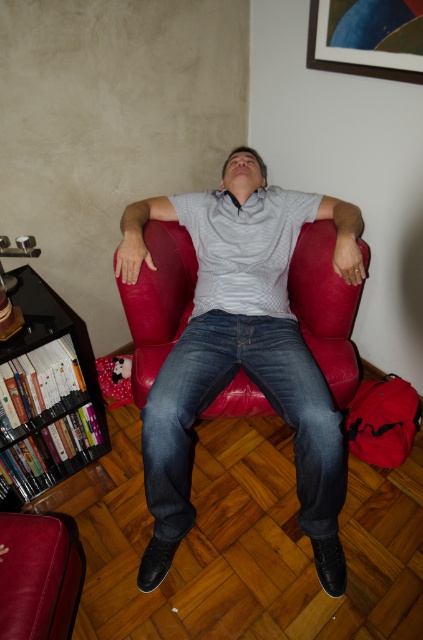
You are standing in the living room and want to place a 2.5 meter long banner from the camera position to the point marked as point (310, 204). Will the banner be long enough to reach that point?

The point marked as point (310, 204) is 1.81 meters from the camera, so the 2.5 meter banner will be long enough to reach that point.

You are standing in the living room and see the gray textured shirt at center and the metallic gold picture frame at upper right. Which object is positioned to the left of the other?

The gray textured shirt at center is to the left of the metallic gold picture frame at upper right.

You are standing in the living room and want to place a small decorative item between the two points marked as point (x=260, y=385) and point (x=3, y=426). Since you want the item to be closer to the viewer, which point should you position it near?

You should position the item near point (x=260, y=385) because it is closer to the viewer than point (x=3, y=426).